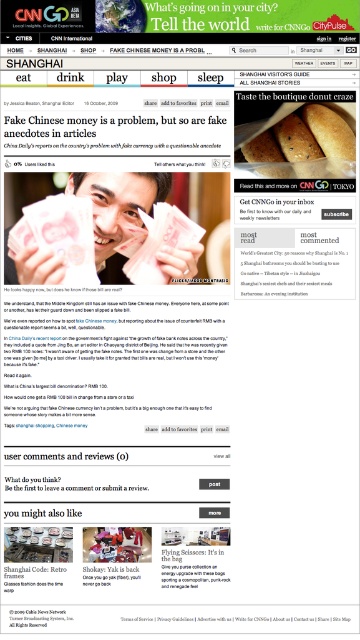
You are a person with a 2.5 feet wide wheelchair. You are in the middle of the webpage and want to move to the bottom of the page. Can you navigate through the space between the brown crumbly donut at upper right and the navigational tabs at the top?

The space between the brown crumbly donut at upper right and the navigational tabs at the top is 3.66 feet, which is wider than your wheelchair. You can safely navigate through this space.

You are a graphic designer working on a webpage layout. You need to place a new element at the point labeled as point (302, 141). What object is already present at that location?

The point (302, 141) is occupied by a brown crumbly donut at upper right.

You are a graphic designer working on a webpage layout for CNN. You need to place a new element at coordinate point 0.223, 0.839. However, there is already a brown crumbly donut at upper right at that location. What should you do?

The brown crumbly donut at upper right is already placed at coordinate point (302,141), so you should choose a different location for the new element to avoid overlapping.